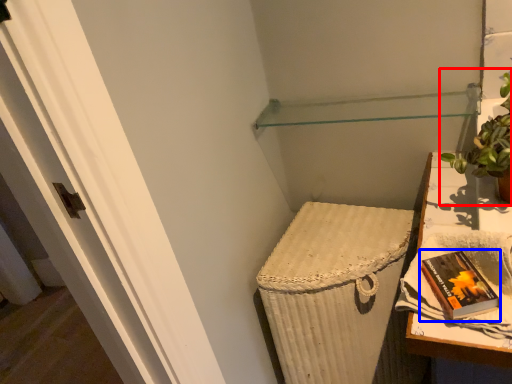
Question: Which of the following is the farthest to the observer, houseplant (highlighted by a red box) or paperback book (highlighted by a blue box)?

Choices:
 (A) houseplant
 (B) paperback book

Answer: (A)